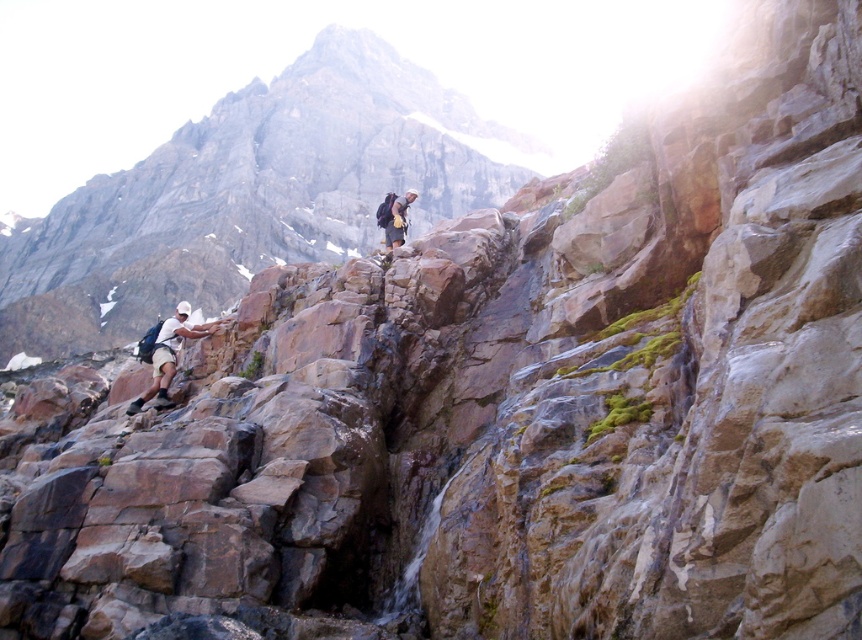
Question: Can you confirm if brown rock at left is wider than matte black backpack at center?

Choices:
 (A) yes
 (B) no

Answer: (A)

Question: Estimate the real-world distances between objects in this image. Which object is closer to the brown rock at left?

Choices:
 (A) matte black backpack at center
 (B) matte black backpack at left

Answer: (A)

Question: Based on their relative distances, which object is farther from the matte black backpack at center?

Choices:
 (A) brown rock at left
 (B) matte black backpack at left

Answer: (A)

Question: Which object is positioned farthest from the brown rock at left?

Choices:
 (A) matte black backpack at center
 (B) matte black backpack at left

Answer: (B)

Question: Can you confirm if brown rock at left is thinner than matte black backpack at left?

Choices:
 (A) no
 (B) yes

Answer: (A)

Question: Does brown rock at left have a greater width compared to matte black backpack at center?

Choices:
 (A) yes
 (B) no

Answer: (A)